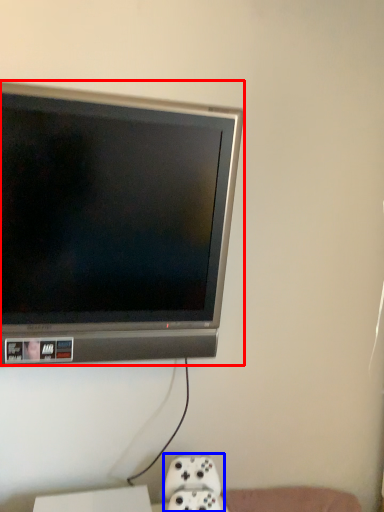
Question: Among these objects, which one is farthest to the camera, television (highlighted by a red box) or game controller (highlighted by a blue box)?

Choices:
 (A) television
 (B) game controller

Answer: (B)